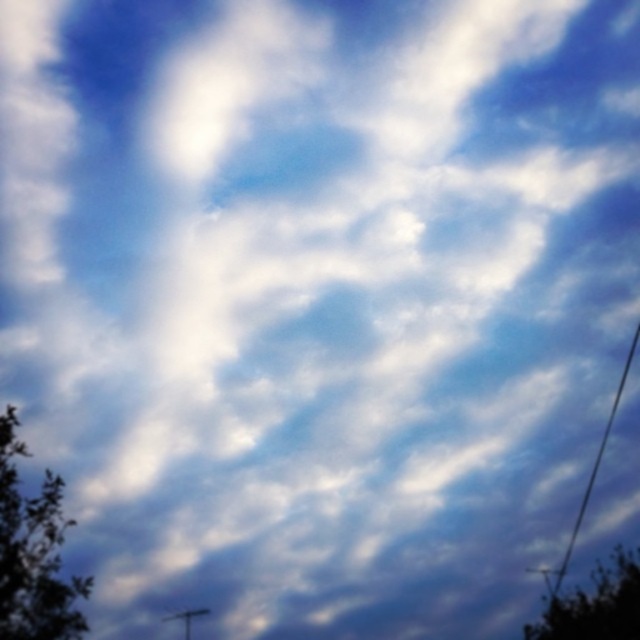
You are standing in the middle of the image and want to walk to the closest tree. Which tree should you walk towards? The green leafy tree at lower left or the green leafy tree at lower right?

The green leafy tree at lower right is narrower than the green leafy tree at lower left, so the green leafy tree at lower left is closer to you. Therefore, you should walk towards the green leafy tree at lower left.